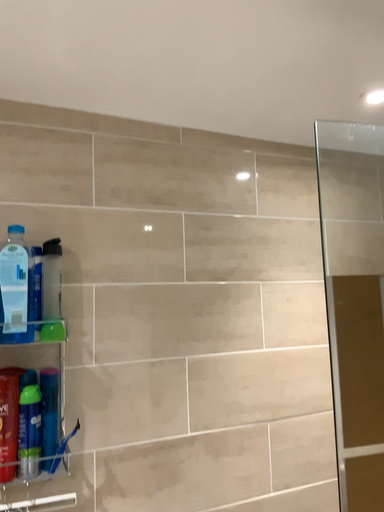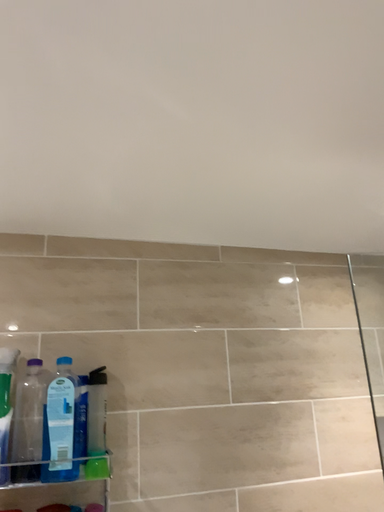
Question: Which way did the camera rotate in the video?

Choices:
 (A) rotated downward
 (B) rotated upward

Answer: (B)